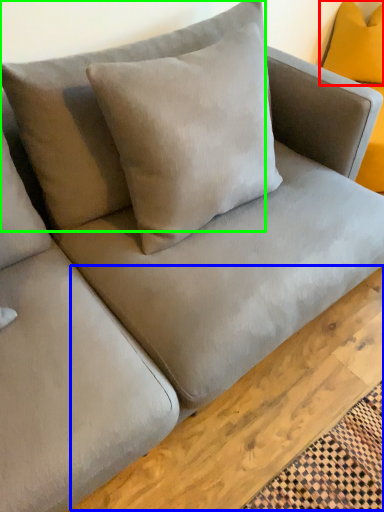
Question: Which object is the closest to the pillow (highlighted by a red box)? Choose among these: plank (highlighted by a blue box) or pillow (highlighted by a green box).

Choices:
 (A) plank
 (B) pillow

Answer: (B)